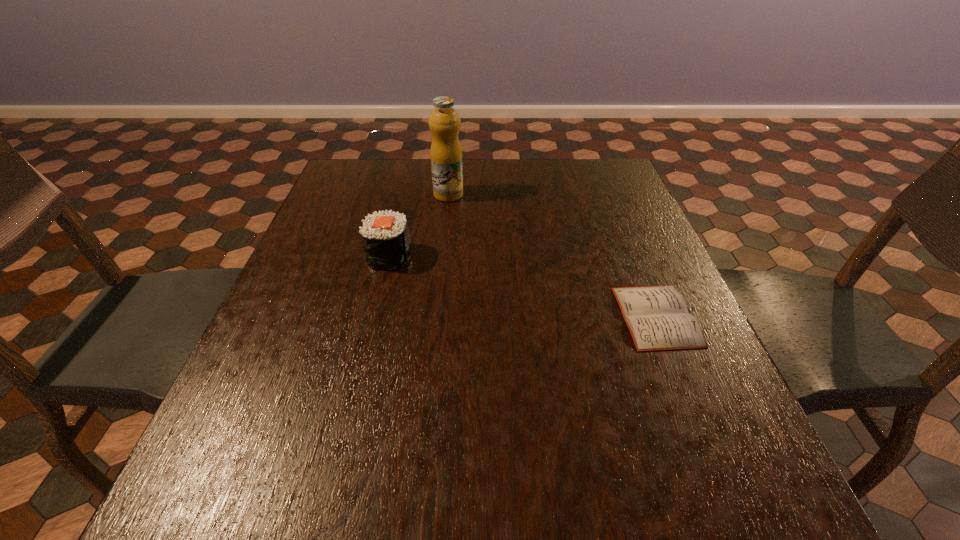
Where is `vacant space in between the rightmost object and the tallest object`? The image size is (960, 540). vacant space in between the rightmost object and the tallest object is located at coordinates (552, 255).

What are the coordinates of `free space between the sushi and the tallest object` in the screenshot? It's located at (419, 225).

I want to click on unoccupied position between the rightmost object and the leftmost object, so click(x=523, y=286).

The image size is (960, 540). What are the coordinates of `unoccupied area between the shortest object and the farthest object` in the screenshot? It's located at (552, 255).

Where is `vacant space that's between the second object from left to right and the shortest object`? The width and height of the screenshot is (960, 540). vacant space that's between the second object from left to right and the shortest object is located at coordinates (552, 255).

Locate an element on the screen. The height and width of the screenshot is (540, 960). vacant region between the leftmost object and the second object from right to left is located at coordinates (419, 225).

Find the location of `empty space that is in between the second tallest object and the diary`. empty space that is in between the second tallest object and the diary is located at coordinates (523, 286).

Locate which object is the closest to the nearest object. Please provide its 2D coordinates. Your answer should be formatted as a tuple, i.e. [(x, y)], where the tuple contains the x and y coordinates of a point satisfying the conditions above.

[(385, 236)]

Where is `object that can be found as the second closest to the second nearest object`? Image resolution: width=960 pixels, height=540 pixels. object that can be found as the second closest to the second nearest object is located at coordinates (657, 317).

Locate an element on the screen. free region that satisfies the following two spatial constraints: 1. on the front label of the second object from left to right; 2. on the right side of the rightmost object is located at coordinates (436, 316).